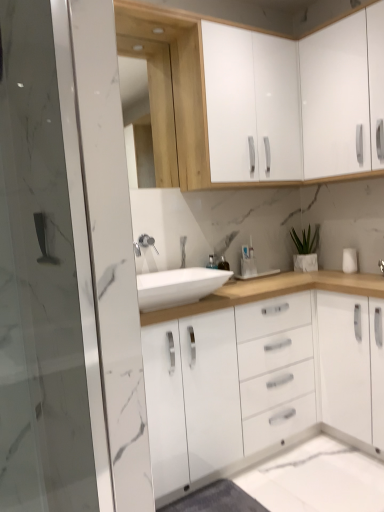
Question: Is point (241, 56) closer or farther from the camera than point (142, 245)?

Choices:
 (A) farther
 (B) closer

Answer: (B)

Question: Relative to satin nickel faucet at center, is white glossy cabinet at upper center, the 1th cabinetry in the left-to-right sequence, in front or behind?

Choices:
 (A) front
 (B) behind

Answer: (A)

Question: Which of these objects is positioned farthest from the satin nickel faucet at center?

Choices:
 (A) white matte plant at upper right
 (B) white glossy cabinet at upper right, which is the second cabinetry from left to right
 (C) natural wood medicine cabinet at upper center
 (D) white glossy cabinet at upper center, the 1th cabinetry in the left-to-right sequence
 (E) white glossy sink at center

Answer: (B)

Question: Estimate the real-world distances between objects in this image. Which object is closer to the white glossy cabinet at upper center, the 1th cabinetry in the left-to-right sequence?

Choices:
 (A) white glossy sink at center
 (B) satin nickel faucet at center
 (C) transparent glass screen door at left
 (D) white glossy cabinet at upper right, acting as the first cabinetry starting from the right
 (E) natural wood medicine cabinet at upper center

Answer: (D)